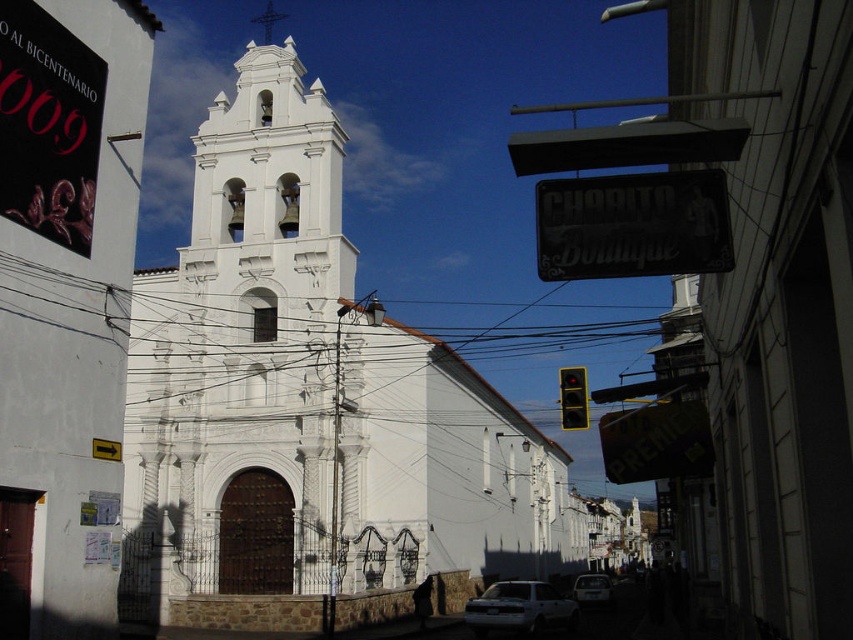
Question: Among these objects, which one is farthest from the camera?

Choices:
 (A) white glossy car at center
 (B) yellow matte traffic light at center

Answer: (A)

Question: Is black metal sign at upper center positioned before yellow matte traffic light at center?

Choices:
 (A) no
 (B) yes

Answer: (B)

Question: Considering the real-world distances, which object is closest to the white stone church at center?

Choices:
 (A) black metal sign at upper center
 (B) white matte car at lower center
 (C) yellow matte traffic light at center
 (D) white glossy car at center

Answer: (C)

Question: Is yellow matte traffic light at center closer to the viewer compared to white glossy car at center?

Choices:
 (A) yes
 (B) no

Answer: (A)

Question: Is white stone church at center closer to camera compared to yellow matte traffic light at center?

Choices:
 (A) yes
 (B) no

Answer: (B)

Question: Among these points, which one is nearest to the camera?

Choices:
 (A) (584, 372)
 (B) (531, 621)
 (C) (409, 426)

Answer: (A)